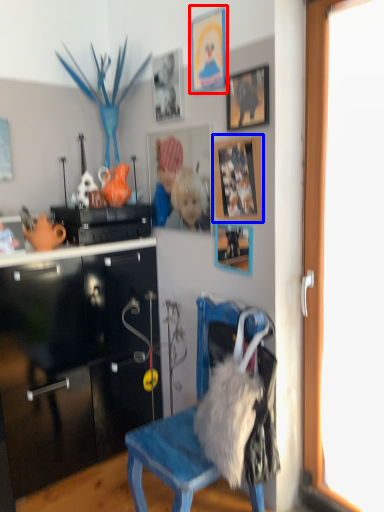
Question: Which of the following is the closest to the observer, picture frame (highlighted by a red box) or picture frame (highlighted by a blue box)?

Choices:
 (A) picture frame
 (B) picture frame

Answer: (B)